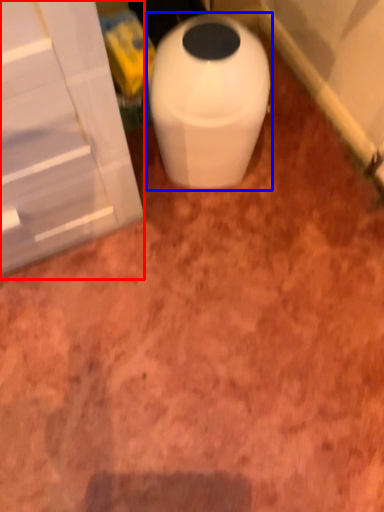
Question: Among these objects, which one is nearest to the camera, screen door (highlighted by a red box) or waste container (highlighted by a blue box)?

Choices:
 (A) screen door
 (B) waste container

Answer: (A)